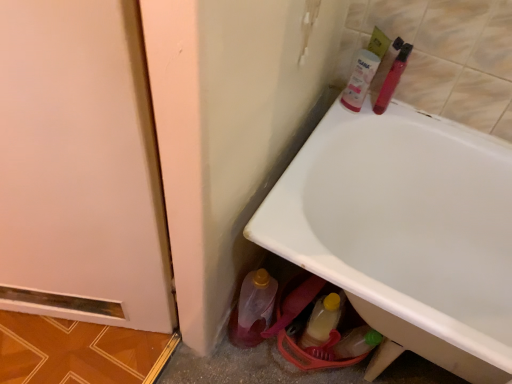
Identify the location of unoccupied region to the right of pink plastic tube at upper right, the 2th mouthwash viewed from the right. The height and width of the screenshot is (384, 512). coord(404,117).